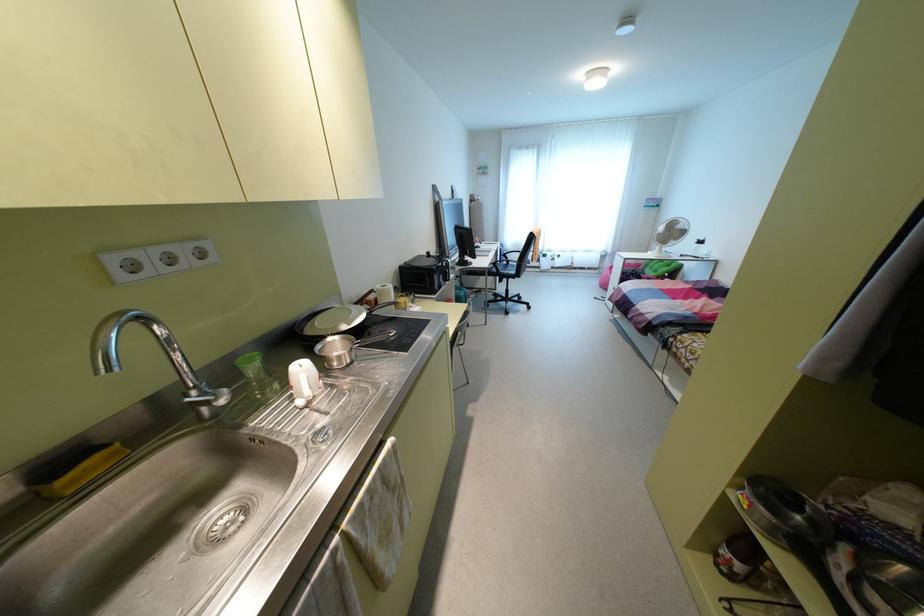
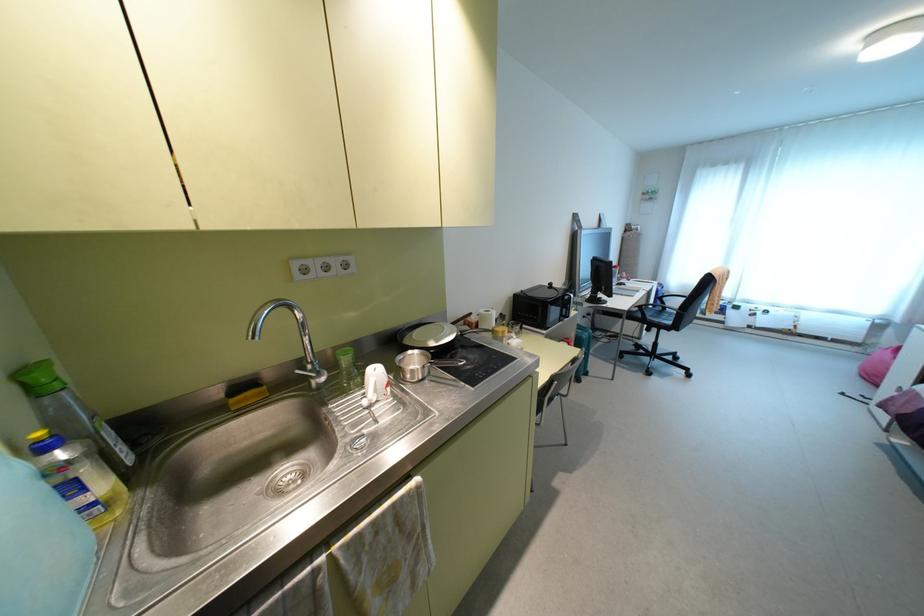
Find the pixel in the second image that matches (513,272) in the first image.

(667, 322)